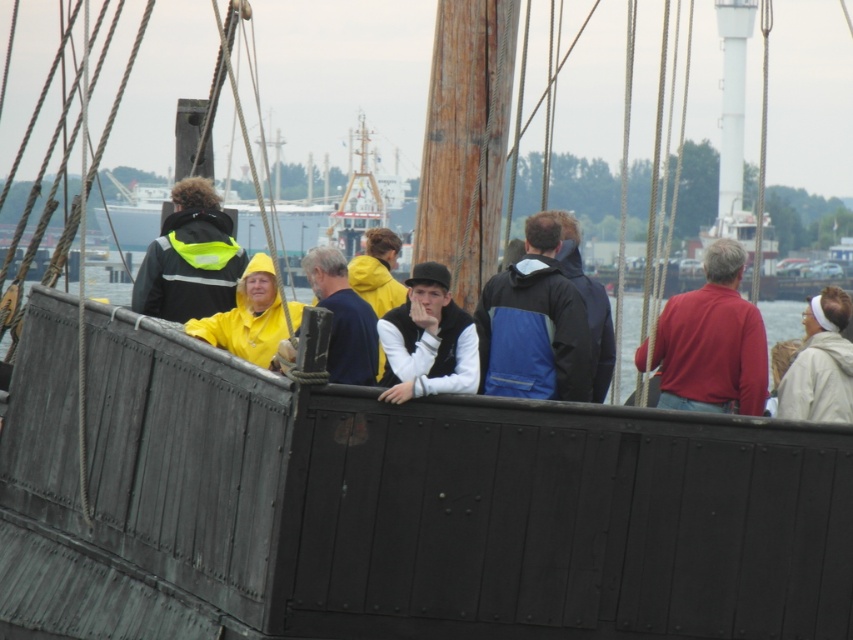
Who is positioned more to the right, matte red shirt at center or matte black vest at center?

matte red shirt at center

Is point (726, 362) positioned in front of point (399, 324)?

That is False.

Image resolution: width=853 pixels, height=640 pixels. Find the location of `matte red shirt at center`. matte red shirt at center is located at coordinates (711, 342).

Can you confirm if rubberized yellow raincoat at center is positioned below dark blue jacket at center?

Yes, rubberized yellow raincoat at center is below dark blue jacket at center.

What do you see at coordinates (248, 316) in the screenshot?
I see `rubberized yellow raincoat at center` at bounding box center [248, 316].

The width and height of the screenshot is (853, 640). In order to click on rubberized yellow raincoat at center in this screenshot , I will do `click(248, 316)`.

Does white fleece jacket at right have a larger size compared to yellow matte jacket at center?

Yes.

Which is in front, point (780, 385) or point (357, 339)?

Positioned in front is point (357, 339).

What do you see at coordinates (820, 364) in the screenshot? I see `white fleece jacket at right` at bounding box center [820, 364].

I want to click on white fleece jacket at right, so click(820, 364).